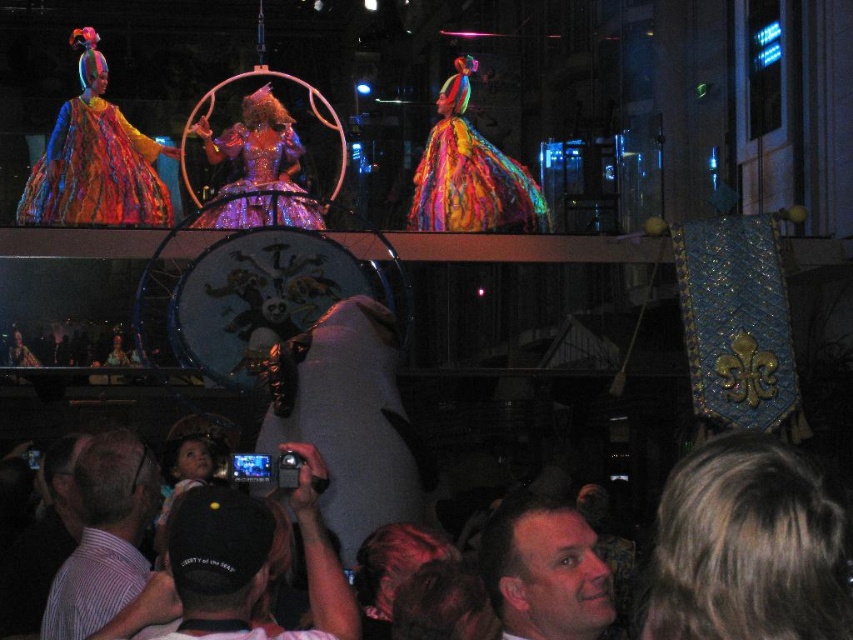
Does point (260, 525) lie behind point (59, 141)?

No.

Who is positioned more to the left, black fabric cap at center or multicolored fabric dress at upper left?

multicolored fabric dress at upper left is more to the left.

Is point (231, 564) behind point (93, 211)?

No, it is not.

Where is `black fabric cap at center`? Image resolution: width=853 pixels, height=640 pixels. black fabric cap at center is located at coordinates (244, 563).

Does multicolored sequined dress at center have a greater width compared to soft white fabric baby at lower left?

Correct, the width of multicolored sequined dress at center exceeds that of soft white fabric baby at lower left.

Describe the element at coordinates (469, 173) in the screenshot. I see `multicolored sequined dress at center` at that location.

Does point (471, 168) come in front of point (210, 476)?

No, (471, 168) is further to viewer.

Locate an element on the screen. This screenshot has width=853, height=640. multicolored sequined dress at center is located at coordinates (469, 173).

What do you see at coordinates (96, 172) in the screenshot? This screenshot has width=853, height=640. I see `multicolored fabric dress at upper left` at bounding box center [96, 172].

Locate an element on the screen. The image size is (853, 640). multicolored fabric dress at upper left is located at coordinates (96, 172).